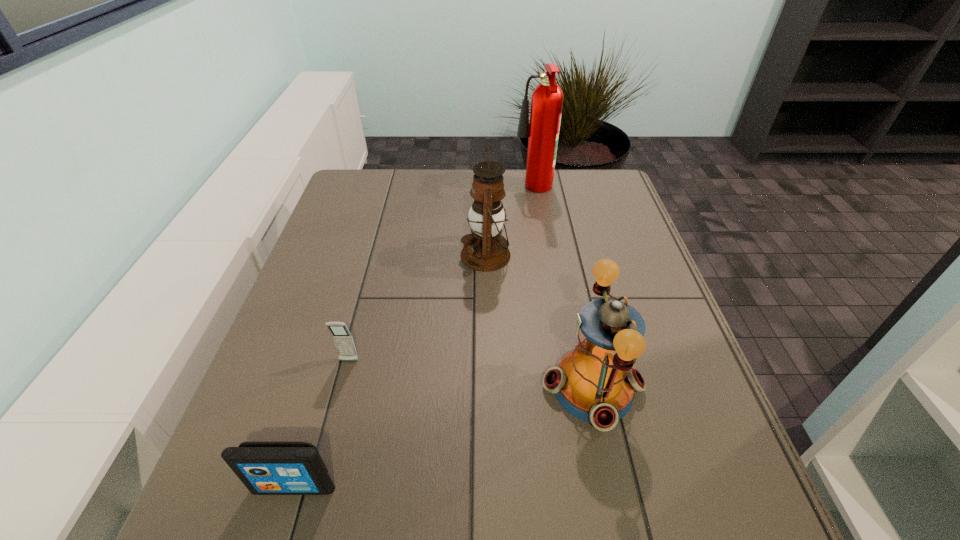
The width and height of the screenshot is (960, 540). I want to click on the farthest object, so click(547, 99).

At what (x,y) coordinates should I click in order to perform the action: click on the tallest object. Please return your answer as a coordinate pair (x, y). This screenshot has width=960, height=540. Looking at the image, I should click on (547, 99).

Where is `the fourth shortest object`? This screenshot has height=540, width=960. the fourth shortest object is located at coordinates (485, 250).

Identify the location of the left lantern. This screenshot has height=540, width=960. (485, 250).

The image size is (960, 540). In order to click on the shorter lantern in this screenshot , I will do `click(595, 383)`.

Locate an element on the screen. the right lantern is located at coordinates (595, 383).

Locate an element on the screen. This screenshot has width=960, height=540. cellular telephone is located at coordinates (342, 337).

The width and height of the screenshot is (960, 540). I want to click on iPod, so click(266, 468).

The width and height of the screenshot is (960, 540). Identify the location of free space located 0.100m at the nozzle of the fire extinguisher. (484, 191).

At what (x,y) coordinates should I click in order to perform the action: click on vacant area situated at the nozzle of the fire extinguisher. Please return your answer as a coordinate pair (x, y). This screenshot has height=540, width=960. Looking at the image, I should click on (432, 191).